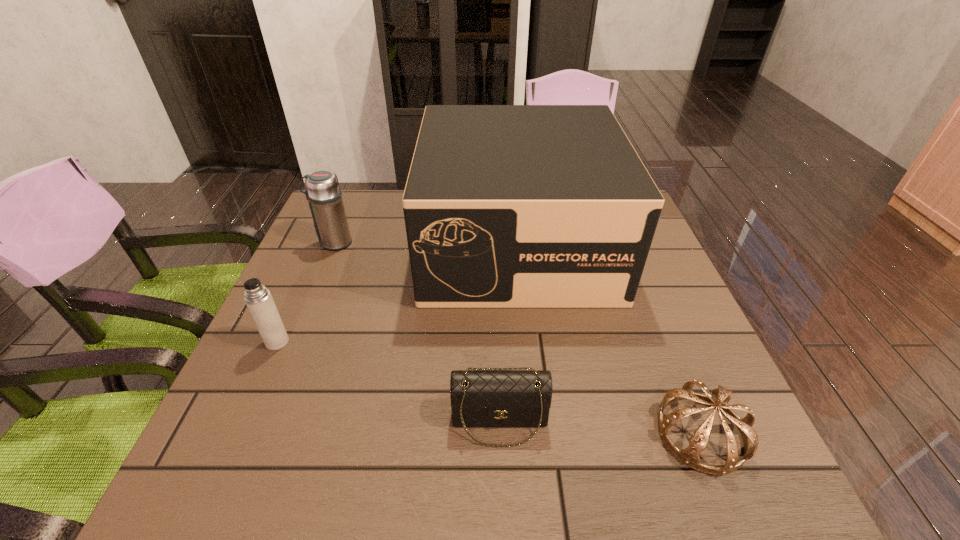
You are a GUI agent. You are given a task and a screenshot of the screen. Output one action in this format:
    pyautogui.click(x=<x>, y=<y>)
    Task: Click on the vacant space at the left edge
    
    Given the screenshot: What is the action you would take?
    pyautogui.click(x=280, y=298)

Where is `vacant space at the right edge of the desktop`? This screenshot has height=540, width=960. vacant space at the right edge of the desktop is located at coordinates (655, 395).

The width and height of the screenshot is (960, 540). What are the coordinates of `free point between the shorter thermos bottle and the clutch bag` in the screenshot? It's located at (389, 381).

Where is `free spot between the tiara and the box`? Image resolution: width=960 pixels, height=540 pixels. free spot between the tiara and the box is located at coordinates (610, 339).

Identify the location of empty space that is in between the farther thermos bottle and the clutch bag. click(x=417, y=332).

This screenshot has height=540, width=960. Identify the location of empty space between the tiara and the box. (610, 339).

Identify the location of vacant space in between the clutch bag and the shorter thermos bottle. This screenshot has height=540, width=960. (389, 381).

Where is `empty space that is in between the tiara and the second tallest object`? empty space that is in between the tiara and the second tallest object is located at coordinates (517, 338).

Where is `free space between the second tallest object and the third farthest object`? free space between the second tallest object and the third farthest object is located at coordinates (305, 292).

Identify the location of free space that is in between the tiara and the tallest object. The width and height of the screenshot is (960, 540). (610, 339).